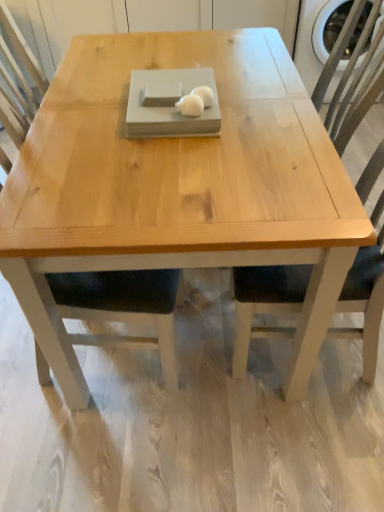
The image size is (384, 512). Identify the location of vacant space in front of natural wood chair at right. (296, 447).